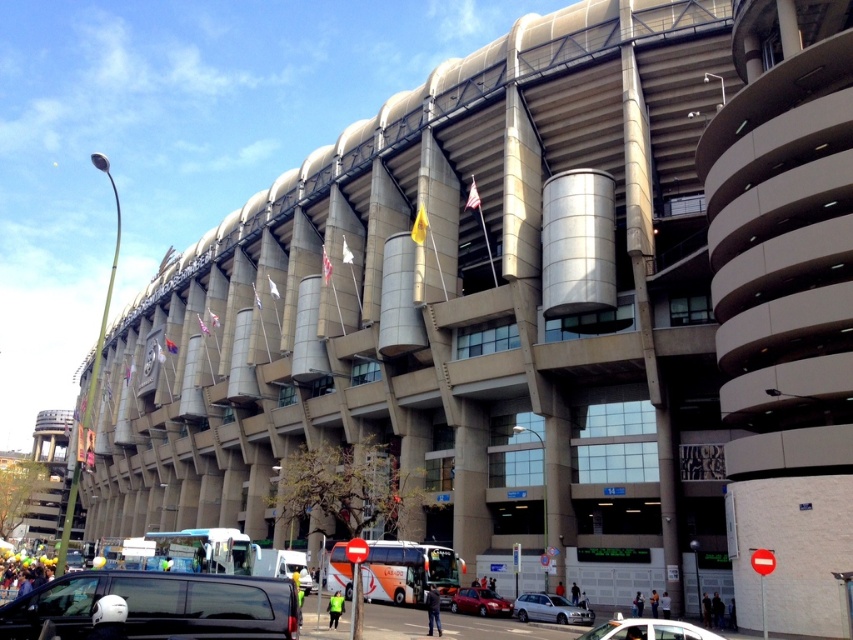
Question: Does black matte van at lower left have a greater width compared to silver metallic sedan at center?

Choices:
 (A) no
 (B) yes

Answer: (B)

Question: Estimate the real-world distances between objects in this image. Which object is farther from the silver metallic sedan at center?

Choices:
 (A) white glossy car at lower center
 (B) metallic red sedan at lower center

Answer: (A)

Question: Which of the following is the farthest from the observer?

Choices:
 (A) (192, 592)
 (B) (459, 595)
 (C) (579, 621)

Answer: (B)

Question: Can you confirm if white glossy car at lower center is thinner than silver metallic sedan at center?

Choices:
 (A) yes
 (B) no

Answer: (B)

Question: Does black matte van at lower left lie in front of metallic red sedan at lower center?

Choices:
 (A) no
 (B) yes

Answer: (B)

Question: Which point appears farthest from the camera in this image?

Choices:
 (A) click(x=558, y=596)
 (B) click(x=503, y=605)
 (C) click(x=640, y=632)

Answer: (B)